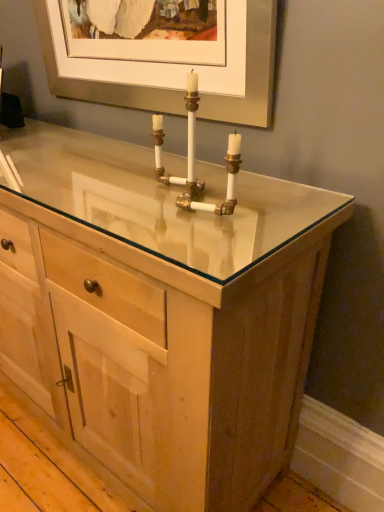
The height and width of the screenshot is (512, 384). Identify the location of vacant space behind white brass pipe at center. (195, 174).